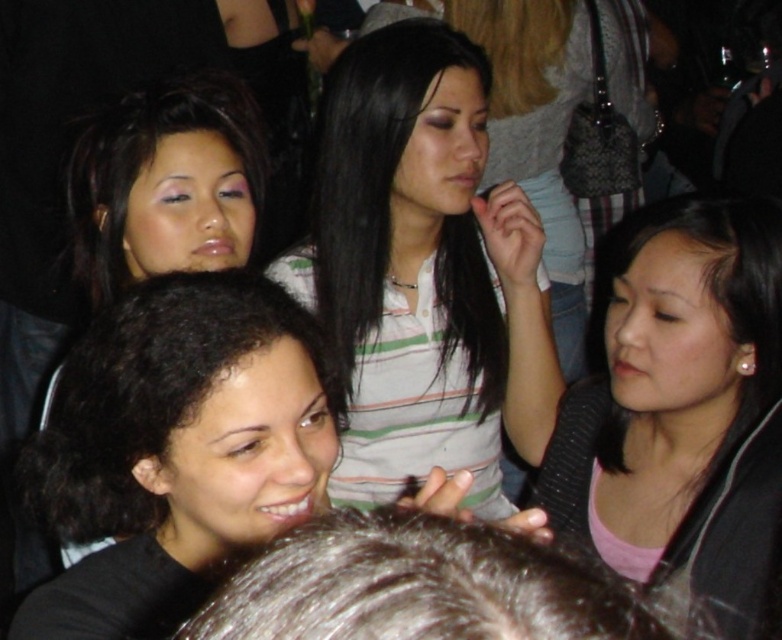
Question: Is striped cotton shirt at center smaller than pink matte sweater at lower right?

Choices:
 (A) yes
 (B) no

Answer: (B)

Question: Which point appears closest to the camera in this image?

Choices:
 (A) (759, 612)
 (B) (585, 589)
 (C) (239, 540)
 (D) (359, 364)

Answer: (B)

Question: Which of the following is the closest to the observer?

Choices:
 (A) black curly hair at lower left
 (B) pink matte sweater at lower right
 (C) matte black hair at upper left

Answer: (A)

Question: Can you confirm if black curly hair at lower left is bigger than dark brown hair at lower center?

Choices:
 (A) no
 (B) yes

Answer: (B)

Question: Is pink matte sweater at lower right bigger than dark brown hair at lower center?

Choices:
 (A) yes
 (B) no

Answer: (A)

Question: Which object is closer to the camera taking this photo?

Choices:
 (A) black curly hair at lower left
 (B) matte black hair at upper left

Answer: (A)